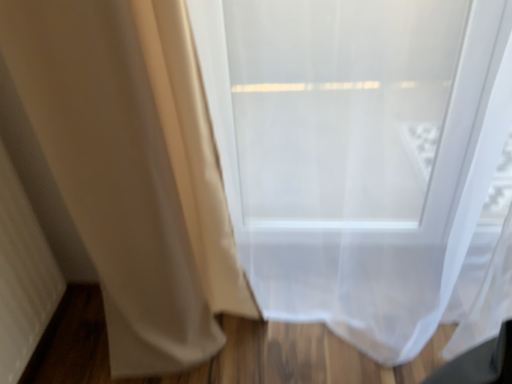
This screenshot has width=512, height=384. Identify the location of matte beige radiator at left. (22, 276).

What is the approximate width of matte beige radiator at left?

26.30 centimeters.

Measure the distance between matte beige radiator at left and camera.

matte beige radiator at left is 3.67 feet away from camera.

The width and height of the screenshot is (512, 384). Describe the element at coordinates (22, 276) in the screenshot. I see `matte beige radiator at left` at that location.

The width and height of the screenshot is (512, 384). Find the location of `matte beige radiator at left`. matte beige radiator at left is located at coordinates (22, 276).